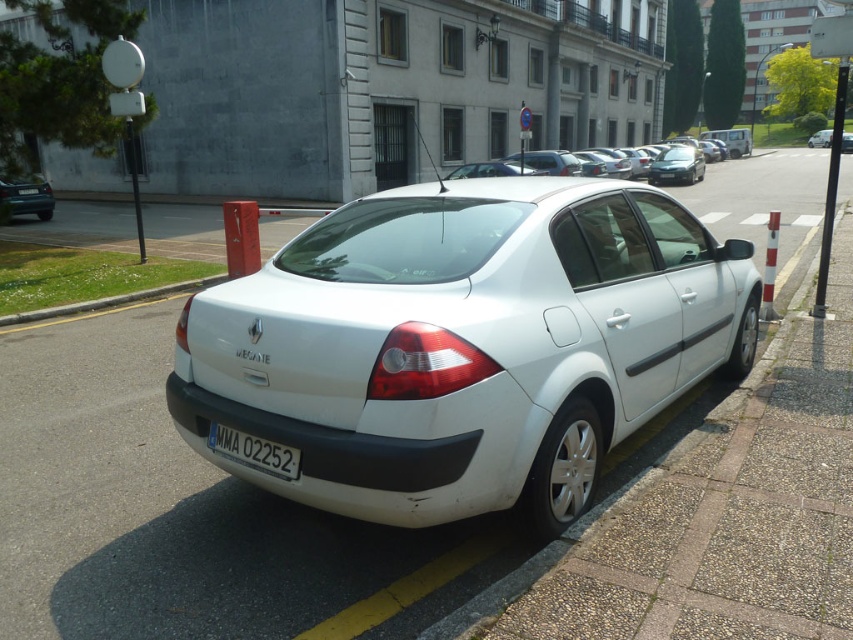
Is matte black car at left taller than satin black sedan at center?

No, matte black car at left is not taller than satin black sedan at center.

Can you confirm if matte black car at left is positioned above satin black sedan at center?

Incorrect, matte black car at left is not positioned above satin black sedan at center.

What do you see at coordinates (26, 196) in the screenshot?
I see `matte black car at left` at bounding box center [26, 196].

Locate an element on the screen. The width and height of the screenshot is (853, 640). matte black car at left is located at coordinates (26, 196).

Which is more to the right, white matte sedan at center or matte black car at left?

white matte sedan at center is more to the right.

Which is behind, point (688, 141) or point (22, 198)?

The point (688, 141) is behind.

Measure the distance between point (x=685, y=177) and camera.

29.48 meters

At what (x,y) coordinates should I click in order to perform the action: click on white matte sedan at center. Please return your answer as a coordinate pair (x, y). The width and height of the screenshot is (853, 640). Looking at the image, I should click on (693, 157).

Does black plastic license plate at lower center have a lesser height compared to satin black sedan at center?

Yes, black plastic license plate at lower center is shorter than satin black sedan at center.

How distant is black plastic license plate at lower center from satin black sedan at center?

The distance of black plastic license plate at lower center from satin black sedan at center is 97.39 feet.

Who is more forward, (241, 438) or (660, 168)?

Point (241, 438) is in front.

This screenshot has height=640, width=853. Find the location of `black plastic license plate at lower center`. black plastic license plate at lower center is located at coordinates (254, 451).